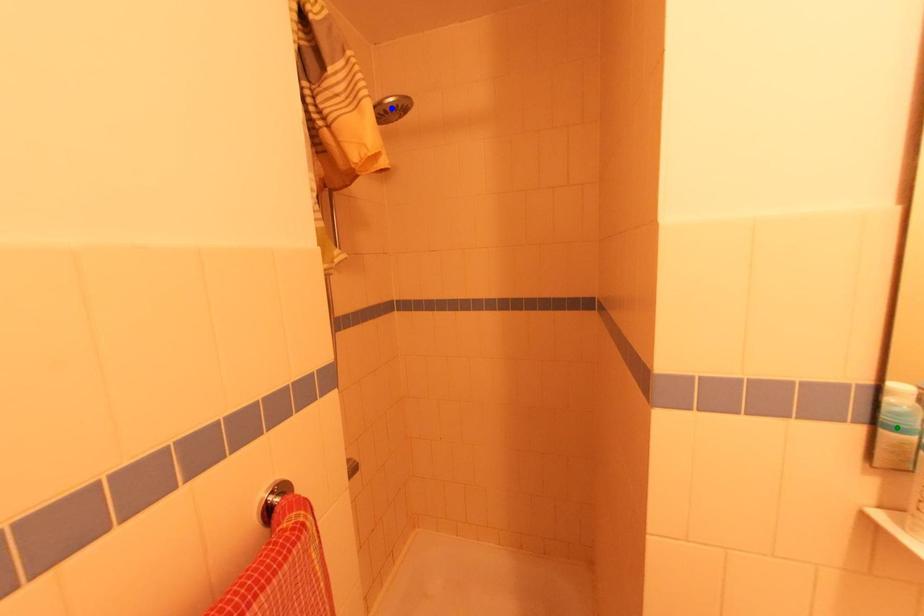
Order these from nearest to farthest:
orange point, green point, blue point

1. green point
2. orange point
3. blue point